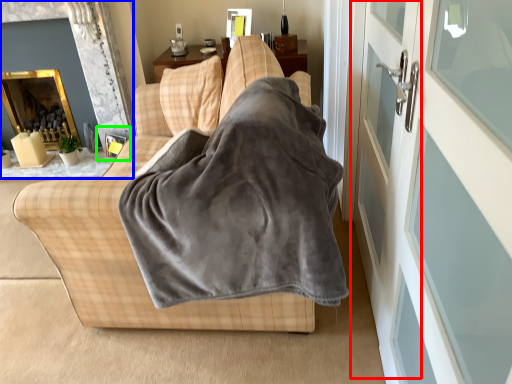
Question: Based on their relative distances, which object is nearer to screen door (highlighted by a red box)? Choose from fireplace (highlighted by a blue box) and picture frame (highlighted by a green box).

Choices:
 (A) fireplace
 (B) picture frame

Answer: (B)